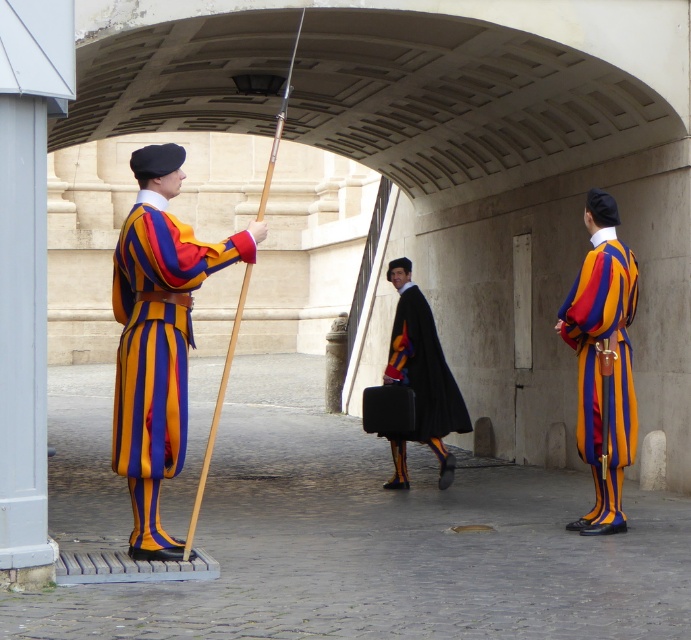
You are a tailor measuring garments for two clients. You have the striped wool uniform at center and the striped wool coat at right. Which garment requires more fabric to make?

The striped wool coat at right requires more fabric to make because it is larger than the striped wool uniform at center.

Which object is located at point (x=600, y=371)?

The striped wool coat at right is located at point (x=600, y=371).

You are a tailor measuring fabrics for alterations. You need to determine which garment requires more fabric vertically between the striped wool coat at right and the black velvet cape at center. Which one needs more fabric vertically?

The striped wool coat at right requires more fabric vertically because it has a greater height compared to the black velvet cape at center.